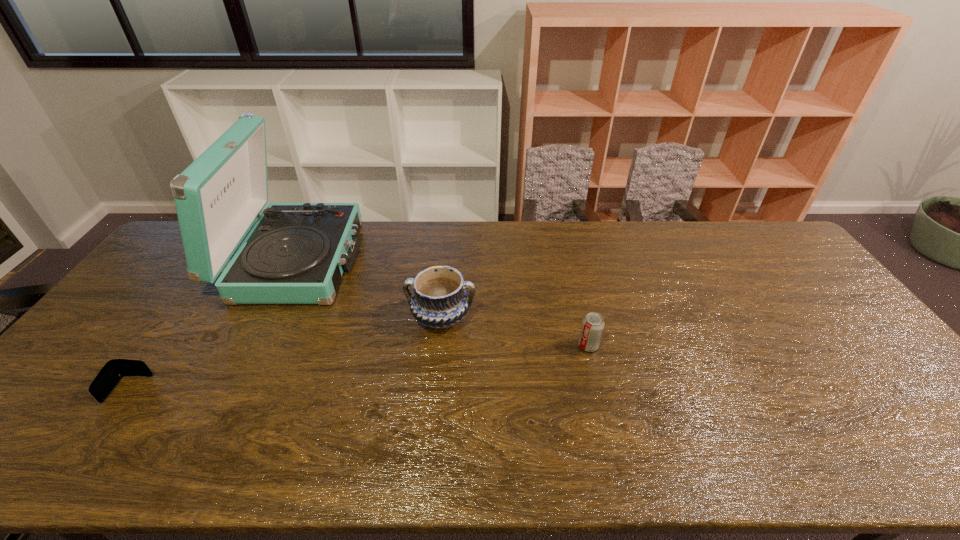
Identify which object is the second nearest to the wallet. Please provide its 2D coordinates. Your answer should be formatted as a tuple, i.e. [(x, y)], where the tuple contains the x and y coordinates of a point satisfying the conditions above.

[(440, 300)]

Find the location of a particular element. Image resolution: width=960 pixels, height=540 pixels. free region that satisfies the following two spatial constraints: 1. on the face side of the record player; 2. on the back side of the second tallest object is located at coordinates (268, 318).

This screenshot has height=540, width=960. I want to click on free space that satisfies the following two spatial constraints: 1. on the face side of the soda can; 2. on the left side of the third object from right to left, so click(x=253, y=346).

Locate an element on the screen. free space that satisfies the following two spatial constraints: 1. on the face side of the third object from left to right; 2. on the left side of the record player is located at coordinates (268, 318).

The image size is (960, 540). I want to click on vacant position in the image that satisfies the following two spatial constraints: 1. on the face side of the record player; 2. on the back side of the rightmost object, so click(x=253, y=346).

The image size is (960, 540). I want to click on free spot that satisfies the following two spatial constraints: 1. on the face side of the tallest object; 2. on the left side of the second tallest object, so click(x=268, y=318).

Find the location of a particular element. free location that satisfies the following two spatial constraints: 1. on the face side of the tallest object; 2. on the right side of the pottery is located at coordinates (268, 318).

Locate an element on the screen. The image size is (960, 540). vacant position in the image that satisfies the following two spatial constraints: 1. on the face side of the second object from left to right; 2. on the right side of the pottery is located at coordinates (268, 318).

Identify the location of vacant space that satisfies the following two spatial constraints: 1. on the face side of the tallest object; 2. on the left side of the rightmost object. The width and height of the screenshot is (960, 540). (253, 346).

Find the location of a particular element. free space that satisfies the following two spatial constraints: 1. on the face side of the second shortest object; 2. on the left side of the record player is located at coordinates (253, 346).